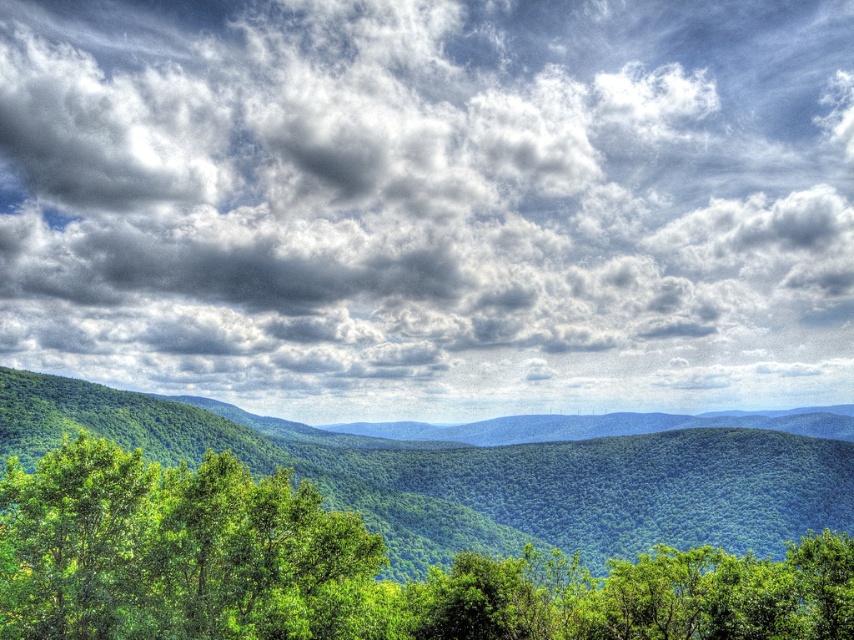
Question: Which point is farther to the camera?

Choices:
 (A) (266, 568)
 (B) (578, 387)

Answer: (B)

Question: Among these points, which one is nearest to the camera?

Choices:
 (A) (287, 572)
 (B) (804, 140)
 (C) (799, 566)

Answer: (A)

Question: Can you confirm if green leafy tree at center is smaller than green leafy tree at lower left?

Choices:
 (A) no
 (B) yes

Answer: (A)

Question: Among these points, which one is farthest from the camera?

Choices:
 (A) (129, 612)
 (B) (56, 176)

Answer: (B)

Question: Is green leafy tree at center to the left of green leafy tree at lower left from the viewer's perspective?

Choices:
 (A) yes
 (B) no

Answer: (B)

Question: Can you confirm if cloudy sky at upper center is positioned to the right of green leafy tree at center?

Choices:
 (A) no
 (B) yes

Answer: (B)